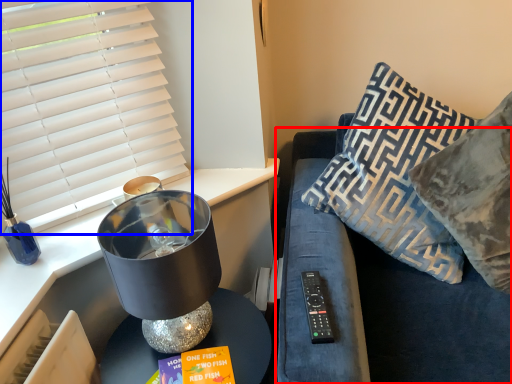
Question: Among these objects, which one is nearest to the camera, couch (highlighted by a red box) or window blind (highlighted by a blue box)?

Choices:
 (A) couch
 (B) window blind

Answer: (A)